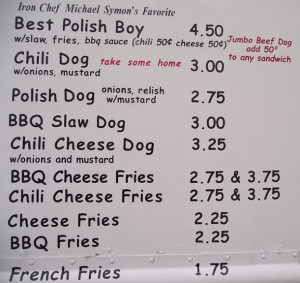
At what (x,y) coordinates should I click in order to perform the action: click on screws. Please return your answer as a coordinate pair (x, y). Image resolution: width=300 pixels, height=283 pixels. Looking at the image, I should click on (30, 261), (73, 261), (110, 257), (153, 259), (190, 257), (227, 258), (264, 255), (294, 253).